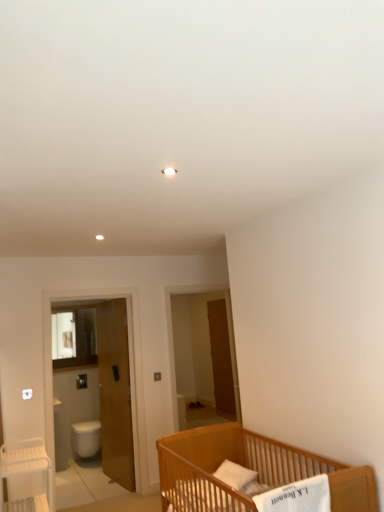
Question: Is wooden door at left in front of or behind brown wooden screen door at center, which ranks as the first screen door in back-to-front order, in the image?

Choices:
 (A) front
 (B) behind

Answer: (A)

Question: Is wooden door at left wider or thinner than brown wooden screen door at center, which ranks as the first screen door in back-to-front order?

Choices:
 (A) thin
 (B) wide

Answer: (B)

Question: Estimate the real-world distances between objects in this image. Which object is farther from the white plastic table at lower left?

Choices:
 (A) brown wooden screen door at center, the 2th screen door when ordered from front to back
 (B) white glossy screen door at left, the 2th screen door positioned from the back
 (C) light brown wooden crib at lower right
 (D) white glossy toilet bowl at lower left
 (E) wooden door at left

Answer: (A)

Question: Which is nearer to the white glossy toilet bowl at lower left?

Choices:
 (A) white plastic table at lower left
 (B) brown wooden screen door at center, positioned as the first screen door in right-to-left order
 (C) white glossy screen door at left, marked as the first screen door in a front-to-back arrangement
 (D) wooden door at left
 (E) light brown wooden crib at lower right

Answer: (C)